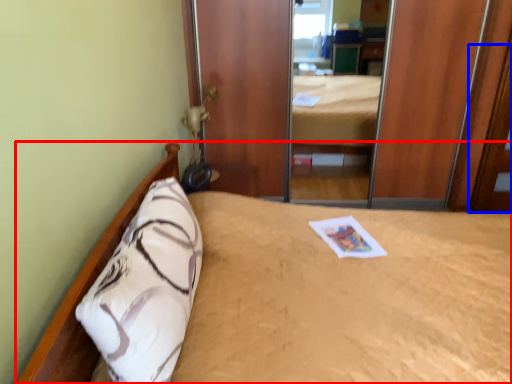
Question: Which object appears closest to the camera in this image, bed (highlighted by a red box) or door (highlighted by a blue box)?

Choices:
 (A) bed
 (B) door

Answer: (A)